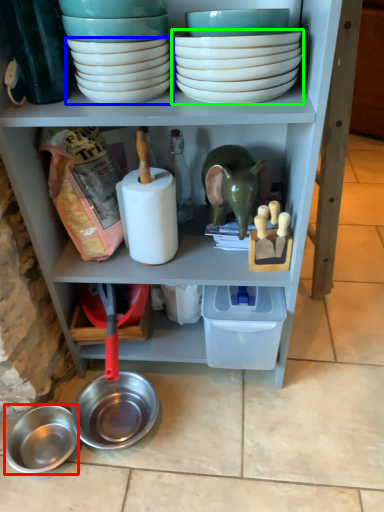
Question: Which object is the closest to the bowl (highlighted by a red box)? Choose among these: bowl (highlighted by a blue box) or bowl (highlighted by a green box).

Choices:
 (A) bowl
 (B) bowl

Answer: (A)